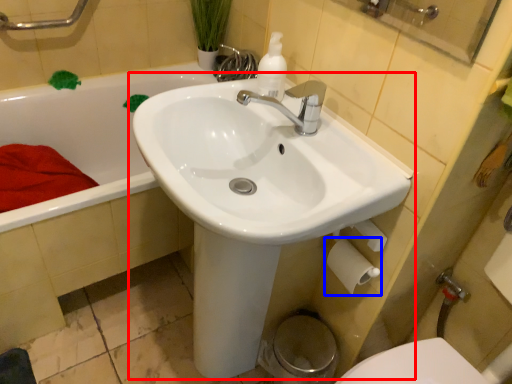
Question: Which of the following is the closest to the observer, sink (highlighted by a red box) or toilet paper (highlighted by a blue box)?

Choices:
 (A) sink
 (B) toilet paper

Answer: (A)